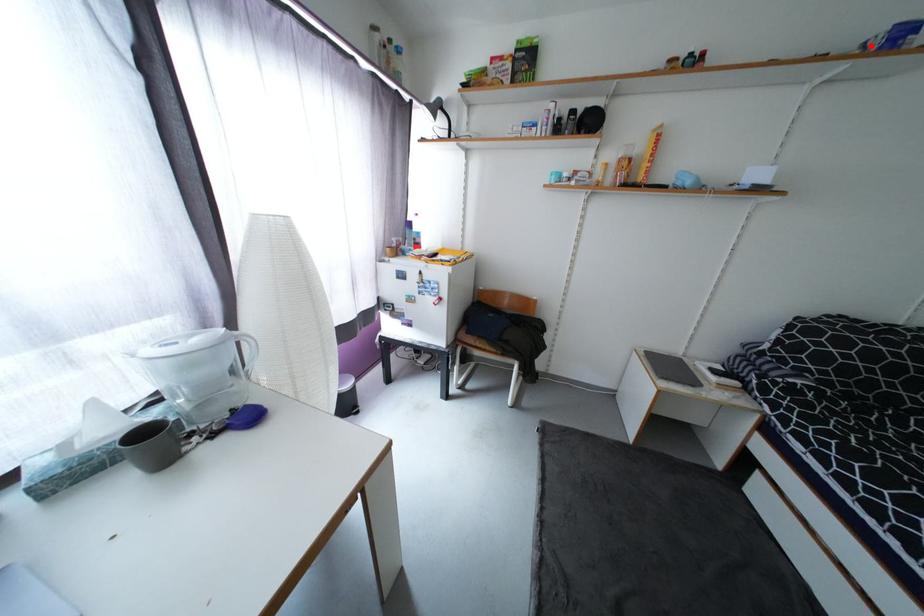
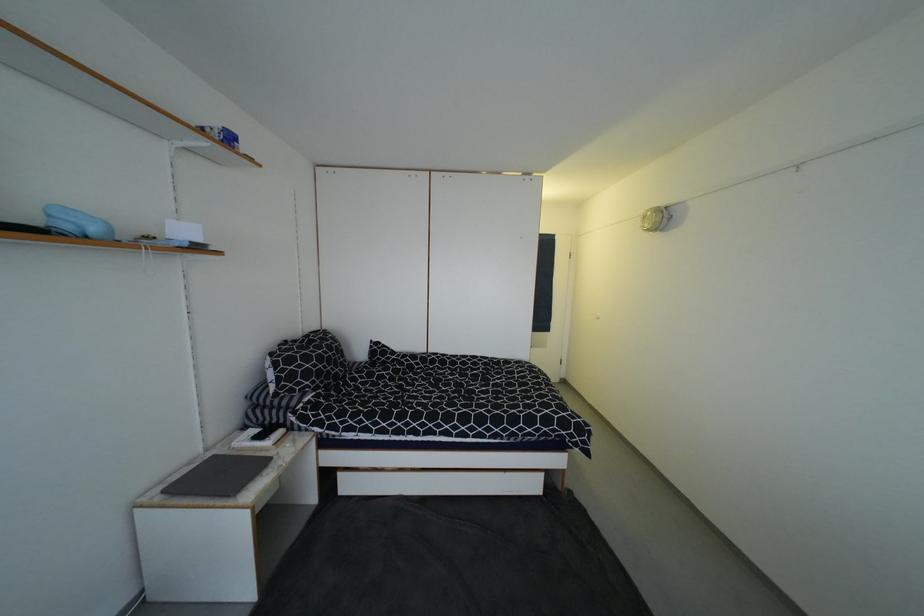
In the second image, find the point that corresponds to the highlighted location in the first image.

(208, 131)